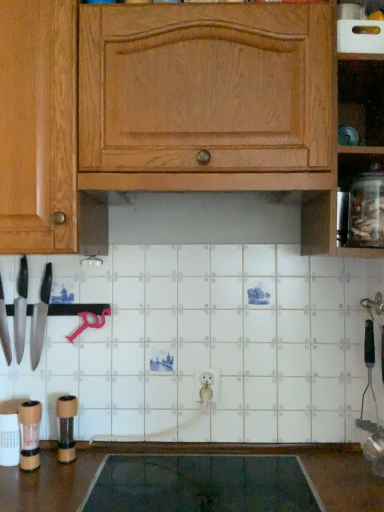
Question: Considering the positions of point (21, 346) and point (350, 215), is point (21, 346) closer or farther from the camera than point (350, 215)?

Choices:
 (A) closer
 (B) farther

Answer: (B)

Question: From the image's perspective, is polished silver knife at left, the 2th knife viewed from the right, above or below clear glass jar at right?

Choices:
 (A) above
 (B) below

Answer: (B)

Question: Considering the real-world distances, which object is farthest from the brown matte pepper grinder at lower left, positioned as the second appliance in left-to-right order?

Choices:
 (A) wooden pepper grinder at lower left, which is counted as the second appliance, starting from the back
 (B) clear glass jar at right
 (C) dark gray rubber mat at lower center
 (D) matte black knife at left, the 1th knife when ordered from right to left
 (E) polished silver knife at left, the 2th knife viewed from the right

Answer: (B)

Question: Based on their relative distances, which object is nearer to the wooden pepper grinder at lower left, arranged as the 2th appliance when viewed from the right?

Choices:
 (A) matte black knife at left, marked as the 3th knife in a left-to-right arrangement
 (B) shiny silver knife at left, which appears as the 1th knife when viewed from the left
 (C) clear glass jar at right
 (D) polished silver knife at left, the 2th knife viewed from the left
 (E) wooden cabinet at upper center

Answer: (A)